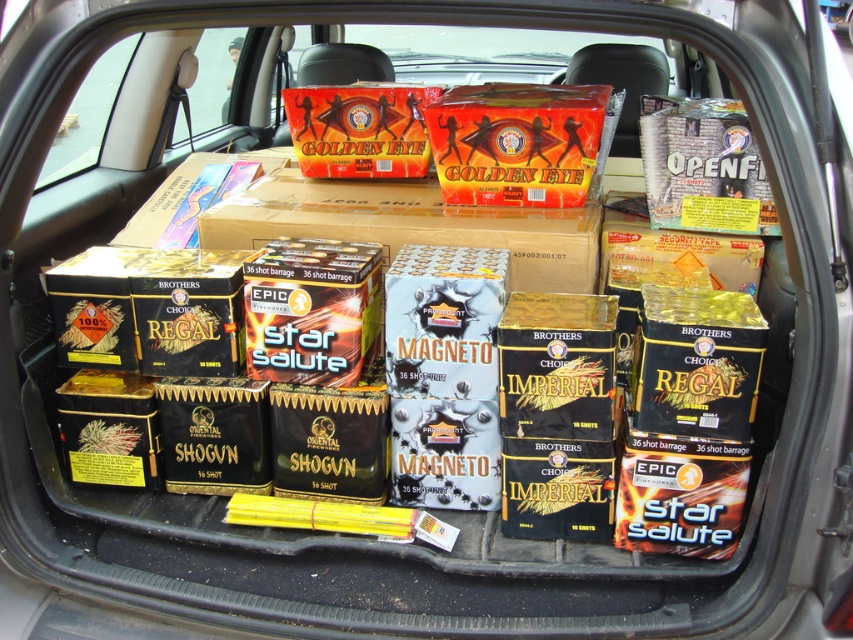
Question: Is orange matte box at center below shiny orange cardboard box at center?

Choices:
 (A) no
 (B) yes

Answer: (B)

Question: Which of the following is the farthest from the observer?

Choices:
 (A) (468, 140)
 (B) (590, 248)

Answer: (A)

Question: Among these points, which one is nearest to the camera?

Choices:
 (A) (332, 93)
 (B) (230, 237)

Answer: (B)

Question: Is orange matte box at center to the left of shiny orange cardboard box at center from the viewer's perspective?

Choices:
 (A) no
 (B) yes

Answer: (A)

Question: In this image, where is orange cardboard box at center located relative to shiny orange cardboard box at center?

Choices:
 (A) above
 (B) below

Answer: (B)

Question: Among these objects, which one is farthest from the camera?

Choices:
 (A) orange matte box at center
 (B) orange cardboard box at center
 (C) shiny orange cardboard box at center

Answer: (C)